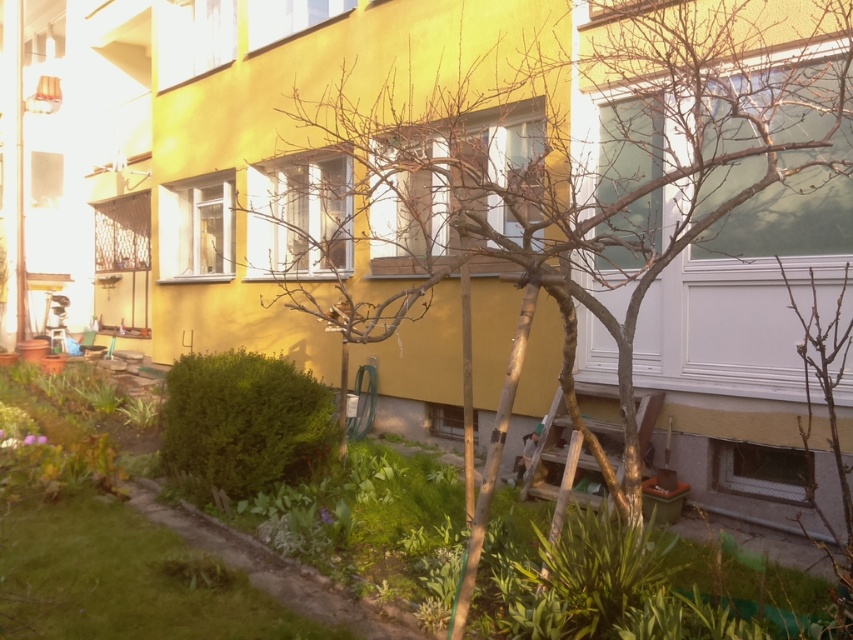
You are standing in the garden looking towards the building. Which object is higher up in your view, the bare wood tree at center or the green grass at lower left?

The bare wood tree at center is higher up in your view than the green grass at lower left.

You are standing in front of the residential building and want to walk towards the green grass at lower left. However, there is a bare wood tree at center in your path. Can you walk around the tree to reach the grass?

The bare wood tree at center is closer to the viewer than the green grass at lower left, so you would need to go around the tree to reach the grass.

You are standing in the garden area of the residential building. You want to place a 3.0 meter long wooden bench in the garden. The bench needs to be placed at least 3.5 meters away from the bare wood tree at center to avoid damaging its roots. Is there enough space between you and the tree to place the bench?

The distance between you and the bare wood tree at center is 3.19 meters, which is less than the required 3.5 meters. Therefore, placing the bench here would be too close to the tree and could damage its roots.